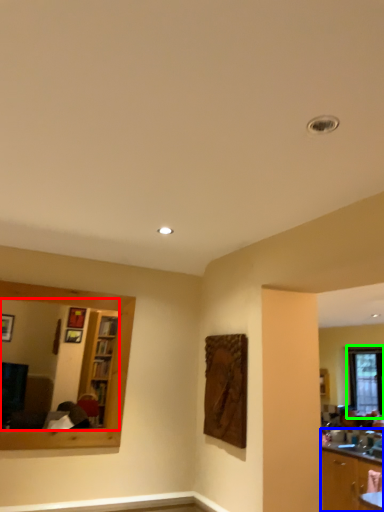
Question: Which is farther away from mirror (highlighted by a red box)? cabinetry (highlighted by a blue box) or window (highlighted by a green box)?

Choices:
 (A) cabinetry
 (B) window

Answer: (B)